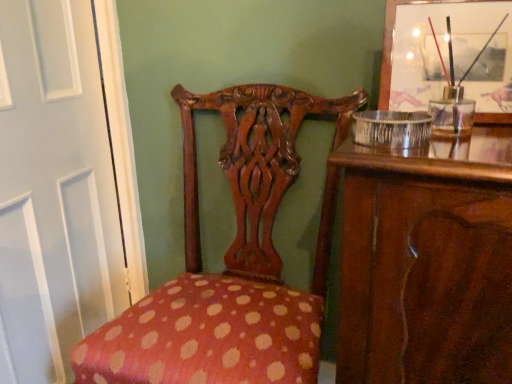
Question: From the image's perspective, is polka dot fabric chair at center above or below white glossy door at left?

Choices:
 (A) above
 (B) below

Answer: (B)

Question: From a real-world perspective, is polka dot fabric chair at center positioned above or below white glossy door at left?

Choices:
 (A) below
 (B) above

Answer: (A)

Question: Which object is the closest to the white glossy door at left?

Choices:
 (A) polka dot fabric chair at center
 (B) wooden picture frame at upper right

Answer: (A)

Question: Estimate the real-world distances between objects in this image. Which object is farther from the white glossy door at left?

Choices:
 (A) polka dot fabric chair at center
 (B) wooden picture frame at upper right

Answer: (B)